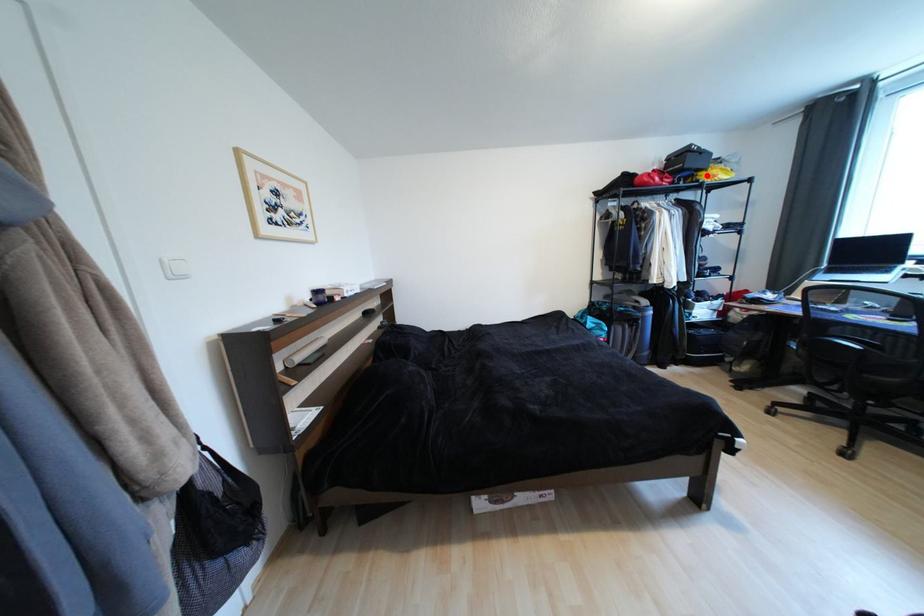
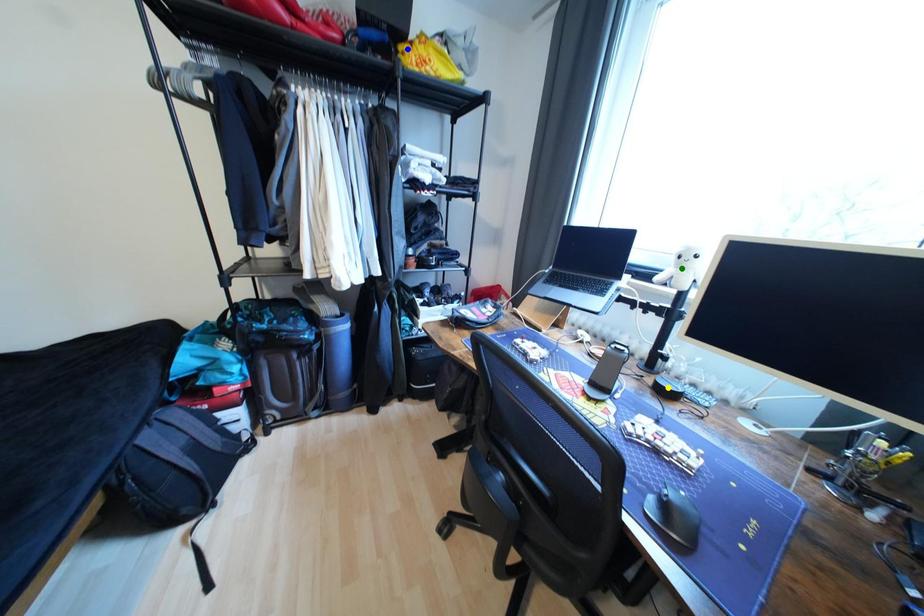
Question: I am providing you with two images of the same scene from different viewpoints. A red point is marked on the first image. You are given multiple points on the second image. Which point in image 2 is actually the same real-world point as the red point in image 1?

Choices:
 (A) green point
 (B) yellow point
 (C) blue point

Answer: (C)